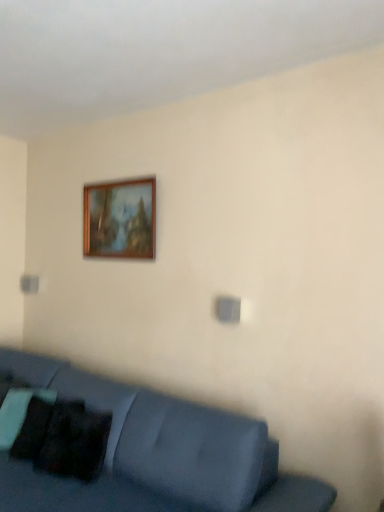
Where is `wooden picture frame at upper center`? wooden picture frame at upper center is located at coordinates (120, 219).

What do you see at coordinates (120, 219) in the screenshot? I see `wooden picture frame at upper center` at bounding box center [120, 219].

Image resolution: width=384 pixels, height=512 pixels. Describe the element at coordinates (63, 439) in the screenshot. I see `black matte pillow at lower left` at that location.

The height and width of the screenshot is (512, 384). What are the coordinates of `matte blue couch at lower left` in the screenshot? It's located at (157, 455).

From the image's perspective, which is above, black matte pillow at lower left or wooden picture frame at upper center?

wooden picture frame at upper center is shown above in the image.

Is black matte pillow at lower left not inside wooden picture frame at upper center?

black matte pillow at lower left is positioned outside wooden picture frame at upper center.

Does black matte pillow at lower left have a greater height compared to wooden picture frame at upper center?

No, black matte pillow at lower left is not taller than wooden picture frame at upper center.

From the picture: Which of these two, black matte pillow at lower left or matte blue couch at lower left, stands taller?

Standing taller between the two is matte blue couch at lower left.

From a real-world perspective, is black matte pillow at lower left positioned over matte blue couch at lower left based on gravity?

Yes.

Could matte blue couch at lower left be considered to be inside black matte pillow at lower left?

No, black matte pillow at lower left does not contain matte blue couch at lower left.

Locate an element on the screen. The height and width of the screenshot is (512, 384). picture frame that is above the matte blue couch at lower left (from the image's perspective) is located at coordinates (120, 219).

From a real-world perspective, does wooden picture frame at upper center sit lower than matte blue couch at lower left?

No.

Is wooden picture frame at upper center turned away from matte blue couch at lower left?

wooden picture frame at upper center is not turned away from matte blue couch at lower left.

Is wooden picture frame at upper center in front of or behind matte blue couch at lower left in the image?

Visually, wooden picture frame at upper center is located behind matte blue couch at lower left.

From a real-world perspective, which object stands above the other?

wooden picture frame at upper center is physically above.

Considering the sizes of objects matte blue couch at lower left and wooden picture frame at upper center in the image provided, who is taller, matte blue couch at lower left or wooden picture frame at upper center?

Standing taller between the two is matte blue couch at lower left.

Measure the distance between matte blue couch at lower left and wooden picture frame at upper center.

The distance of matte blue couch at lower left from wooden picture frame at upper center is 3.97 feet.

Is matte blue couch at lower left in front of wooden picture frame at upper center?

Yes, matte blue couch at lower left is closer to the camera.

Are matte blue couch at lower left and black matte pillow at lower left far apart?

No, matte blue couch at lower left is not far away from black matte pillow at lower left.

Is matte blue couch at lower left inside the boundaries of black matte pillow at lower left, or outside?

matte blue couch at lower left cannot be found inside black matte pillow at lower left.

Locate an element on the screen. The image size is (384, 512). studio couch that is on the left side of black matte pillow at lower left is located at coordinates (157, 455).

Is matte blue couch at lower left wider than black matte pillow at lower left?

Yes, matte blue couch at lower left is wider than black matte pillow at lower left.

Locate an element on the screen. The image size is (384, 512). pillow that is on the left side of wooden picture frame at upper center is located at coordinates (63, 439).

Is wooden picture frame at upper center positioned far away from black matte pillow at lower left?

Yes, wooden picture frame at upper center and black matte pillow at lower left are located far from each other.

In the scene shown: Between wooden picture frame at upper center and black matte pillow at lower left, which one has smaller width?

Thinner between the two is wooden picture frame at upper center.

You are a GUI agent. You are given a task and a screenshot of the screen. Output one action in this format:
    pyautogui.click(x=<x>, y=<y>)
    Task: Click on the picture frame on the right side of black matte pillow at lower left
    This screenshot has width=384, height=512.
    Given the screenshot: What is the action you would take?
    pyautogui.click(x=120, y=219)

The width and height of the screenshot is (384, 512). What are the coordinates of `pillow behind the matte blue couch at lower left` in the screenshot? It's located at (63, 439).

Looking at the image, which one is located further to black matte pillow at lower left, wooden picture frame at upper center or matte blue couch at lower left?

The object further to black matte pillow at lower left is wooden picture frame at upper center.

Which object lies nearer to the anchor point black matte pillow at lower left, matte blue couch at lower left or wooden picture frame at upper center?

The object closer to black matte pillow at lower left is matte blue couch at lower left.

Which object lies further to the anchor point matte blue couch at lower left, black matte pillow at lower left or wooden picture frame at upper center?

Among the two, wooden picture frame at upper center is located further to matte blue couch at lower left.

Considering their positions, is matte blue couch at lower left positioned closer to wooden picture frame at upper center than black matte pillow at lower left?

Based on the image, matte blue couch at lower left appears to be nearer to wooden picture frame at upper center.

Which object lies further to the anchor point matte blue couch at lower left, wooden picture frame at upper center or black matte pillow at lower left?

wooden picture frame at upper center is further to matte blue couch at lower left.

Based on their spatial positions, is black matte pillow at lower left or matte blue couch at lower left closer to wooden picture frame at upper center?

matte blue couch at lower left lies closer to wooden picture frame at upper center than the other object.

The image size is (384, 512). Identify the location of pillow between matte blue couch at lower left and wooden picture frame at upper center from front to back. pyautogui.click(x=63, y=439).